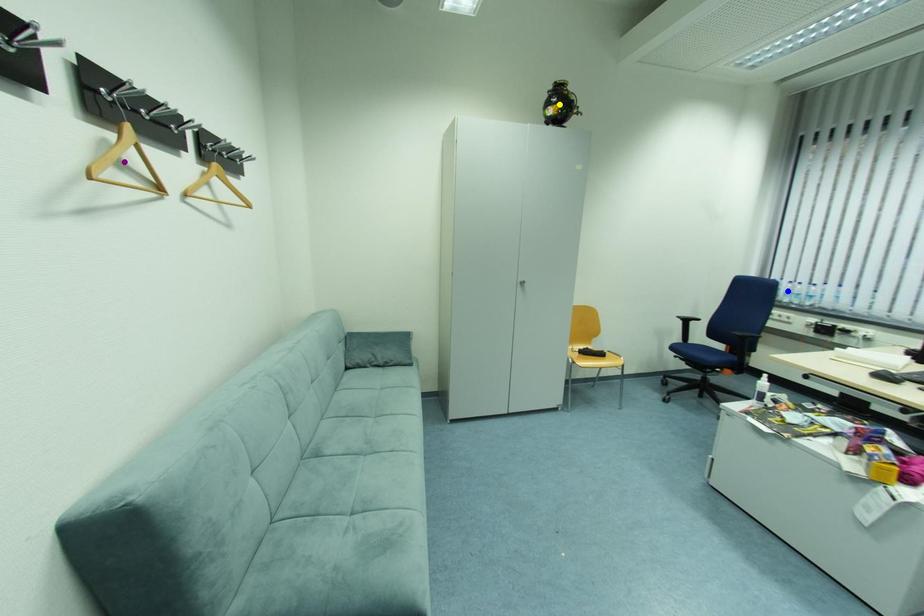
Order these from nearest to farthest:
blue point | yellow point | purple point

1. purple point
2. yellow point
3. blue point